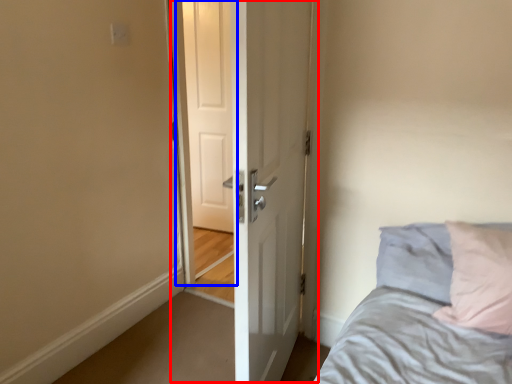
Question: Among these objects, which one is nearest to the camera, door (highlighted by a red box) or screen door (highlighted by a blue box)?

Choices:
 (A) door
 (B) screen door

Answer: (A)